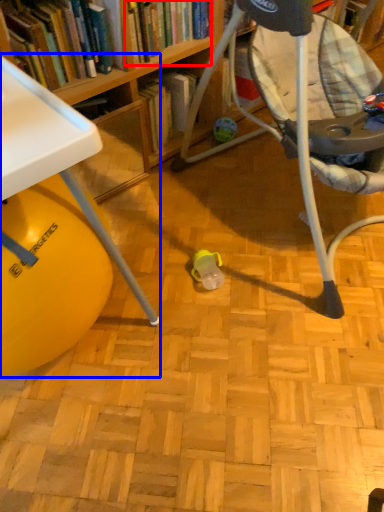
Question: Which point is further to the camera, book (highlighted by a red box) or table (highlighted by a blue box)?

Choices:
 (A) book
 (B) table

Answer: (A)